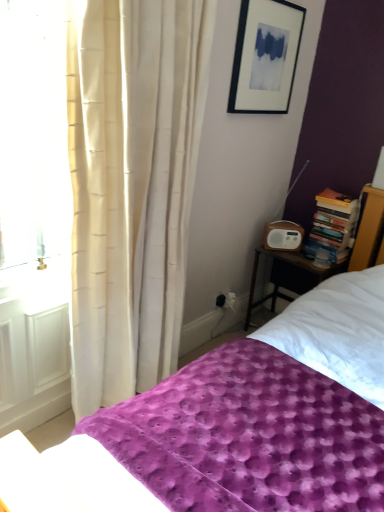
Image resolution: width=384 pixels, height=512 pixels. What do you see at coordinates (265, 56) in the screenshot?
I see `black matte picture frame at upper center` at bounding box center [265, 56].

Locate an element on the screen. The height and width of the screenshot is (512, 384). black matte picture frame at upper center is located at coordinates (265, 56).

Measure the distance between wooden nightstand at right and camera.

wooden nightstand at right is 2.33 meters away from camera.

This screenshot has width=384, height=512. What do you see at coordinates (228, 439) in the screenshot? I see `purple textured blanket at lower center` at bounding box center [228, 439].

This screenshot has width=384, height=512. What do you see at coordinates (333, 223) in the screenshot?
I see `hardcover books at right` at bounding box center [333, 223].

Image resolution: width=384 pixels, height=512 pixels. In order to click on black matte picture frame at upper center in this screenshot , I will do `click(265, 56)`.

From the image's perspective, which one is positioned higher, black matte picture frame at upper center or purple textured blanket at lower center?

From the image's view, black matte picture frame at upper center is above.

Is point (295, 39) positioned after point (348, 473)?

Yes.

Looking at this image, would you consider black matte picture frame at upper center to be distant from purple textured blanket at lower center?

Yes, black matte picture frame at upper center and purple textured blanket at lower center are quite far apart.

In the image, is black matte picture frame at upper center positioned in front of or behind purple textured blanket at lower center?

Clearly, black matte picture frame at upper center is behind purple textured blanket at lower center.

Between black matte picture frame at upper center and wooden nightstand at right, which one has less height?

black matte picture frame at upper center.

Is wooden nightstand at right located within black matte picture frame at upper center?

No, black matte picture frame at upper center does not contain wooden nightstand at right.

Are black matte picture frame at upper center and wooden nightstand at right beside each other?

No, black matte picture frame at upper center is not making contact with wooden nightstand at right.

This screenshot has width=384, height=512. Find the location of `picture frame located above the wooden nightstand at right (from a real-world perspective)`. picture frame located above the wooden nightstand at right (from a real-world perspective) is located at coordinates (265, 56).

Considering the positions of objects hardcover books at right and wooden nightstand at right in the image provided, who is more to the left, hardcover books at right or wooden nightstand at right?

From the viewer's perspective, wooden nightstand at right appears more on the left side.

From the picture: From the image's perspective, is hardcover books at right located beneath wooden nightstand at right?

Actually, hardcover books at right appears above wooden nightstand at right in the image.

Does hardcover books at right have a greater width compared to wooden nightstand at right?

In fact, hardcover books at right might be narrower than wooden nightstand at right.

From the image's perspective, between wooden nightstand at right and hardcover books at right, who is located below?

wooden nightstand at right.

Which of these two, wooden nightstand at right or hardcover books at right, is bigger?

wooden nightstand at right.

Is there a large distance between wooden nightstand at right and hardcover books at right?

wooden nightstand at right is actually quite close to hardcover books at right.

Does wooden nightstand at right have a greater width compared to hardcover books at right?

Yes.

Is hardcover books at right positioned in front of purple textured blanket at lower center?

No, hardcover books at right is further to the viewer.

Could you tell me if hardcover books at right is facing purple textured blanket at lower center?

No, hardcover books at right is not facing towards purple textured blanket at lower center.

Locate an element on the screen. bed in front of the hardcover books at right is located at coordinates (228, 439).

Is purple textured blanket at lower center not inside wooden nightstand at right?

That's correct, purple textured blanket at lower center is outside of wooden nightstand at right.

Is point (254, 506) positioned behind point (301, 268)?

No, it is not.

Is purple textured blanket at lower center beside wooden nightstand at right?

There is a gap between purple textured blanket at lower center and wooden nightstand at right.

Considering the relative sizes of purple textured blanket at lower center and wooden nightstand at right in the image provided, is purple textured blanket at lower center thinner than wooden nightstand at right?

Incorrect, the width of purple textured blanket at lower center is not less than that of wooden nightstand at right.

You are a GUI agent. You are given a task and a screenshot of the screen. Output one action in this format:
    pyautogui.click(x=<x>, y=<y>)
    Task: Click on the book behind the purple textured blanket at lower center
    This screenshot has height=512, width=384.
    Given the screenshot: What is the action you would take?
    pyautogui.click(x=333, y=223)

Is point (294, 372) closer or farther from the camera than point (321, 232)?

Point (294, 372) appears to be closer to the viewer than point (321, 232).

Would you say purple textured blanket at lower center is inside or outside hardcover books at right?

purple textured blanket at lower center cannot be found inside hardcover books at right.

Between purple textured blanket at lower center and hardcover books at right, which one has larger size?

purple textured blanket at lower center.

In order to click on picture frame above the purple textured blanket at lower center (from the image's perspective) in this screenshot , I will do `click(265, 56)`.

Identify the location of picture frame that appears above the wooden nightstand at right (from a real-world perspective). The width and height of the screenshot is (384, 512). coord(265,56).

In the scene shown: Based on their spatial positions, is hardcover books at right or purple textured blanket at lower center closer to black matte picture frame at upper center?

hardcover books at right lies closer to black matte picture frame at upper center than the other object.

Looking at the image, which one is located closer to hardcover books at right, wooden nightstand at right or black matte picture frame at upper center?

The object closer to hardcover books at right is wooden nightstand at right.

Which object lies further to the anchor point purple textured blanket at lower center, wooden nightstand at right or hardcover books at right?

hardcover books at right lies further to purple textured blanket at lower center than the other object.

Considering their positions, is hardcover books at right positioned further to purple textured blanket at lower center than black matte picture frame at upper center?

Based on the image, black matte picture frame at upper center appears to be further to purple textured blanket at lower center.

Looking at the image, which one is located closer to black matte picture frame at upper center, purple textured blanket at lower center or hardcover books at right?

hardcover books at right is positioned closer to the anchor black matte picture frame at upper center.

Based on their spatial positions, is wooden nightstand at right or purple textured blanket at lower center closer to hardcover books at right?

Among the two, wooden nightstand at right is located nearer to hardcover books at right.

Based on their spatial positions, is black matte picture frame at upper center or wooden nightstand at right further from purple textured blanket at lower center?

Among the two, black matte picture frame at upper center is located further to purple textured blanket at lower center.

Consider the image. From the image, which object appears to be nearer to wooden nightstand at right, purple textured blanket at lower center or hardcover books at right?

hardcover books at right is positioned closer to the anchor wooden nightstand at right.

Find the location of a particular element. Image resolution: width=384 pixels, height=512 pixels. picture frame positioned between purple textured blanket at lower center and hardcover books at right from near to far is located at coordinates (265, 56).

Identify the location of nightstand between purple textured blanket at lower center and hardcover books at right along the z-axis. (289, 276).

Identify the location of picture frame between purple textured blanket at lower center and wooden nightstand at right from front to back. (265, 56).

Locate an element on the screen. book between black matte picture frame at upper center and wooden nightstand at right from top to bottom is located at coordinates (333, 223).